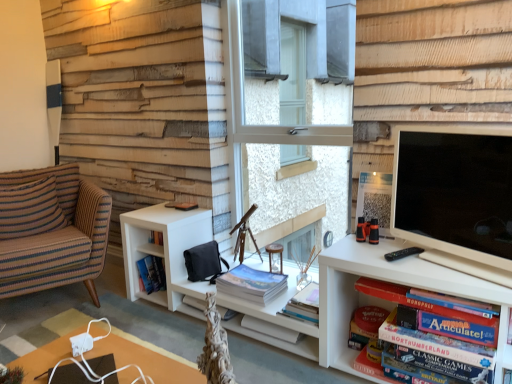
Question: From a real-world perspective, is hardcover book at lower right, the second paperback book when ordered from left to right, physically located above or below striped fabric pillow at left?

Choices:
 (A) above
 (B) below

Answer: (B)

Question: Looking at the image, does hardcover book at lower right, which is counted as the first paperback book, starting from the right, seem bigger or smaller compared to striped fabric pillow at left?

Choices:
 (A) big
 (B) small

Answer: (B)

Question: Which object is positioned farthest from the white matte bookcase at center?

Choices:
 (A) matte board game at lower right, placed as the 1th book when sorted from front to back
 (B) white plastic table at lower left
 (C) matte white tv at right
 (D) hardcover book at lower right, the second paperback book when ordered from left to right
 (E) striped fabric armchair at left

Answer: (B)

Question: Based on their relative distances, which object is farther from the white paper at center, which ranks as the 2th paperback book in right-to-left order?

Choices:
 (A) white matte bookcase at center
 (B) matte board game at lower right, which ranks as the first book in right-to-left order
 (C) striped fabric armchair at left
 (D) white plastic table at lower left
 (E) striped fabric pillow at left

Answer: (E)